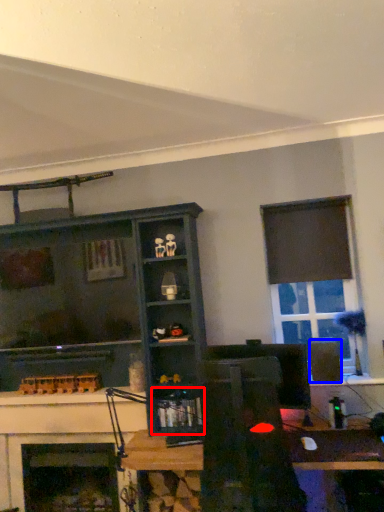
Question: Which of the following is the farthest to the observer, shelf (highlighted by a red box) or speaker (highlighted by a blue box)?

Choices:
 (A) shelf
 (B) speaker

Answer: (A)